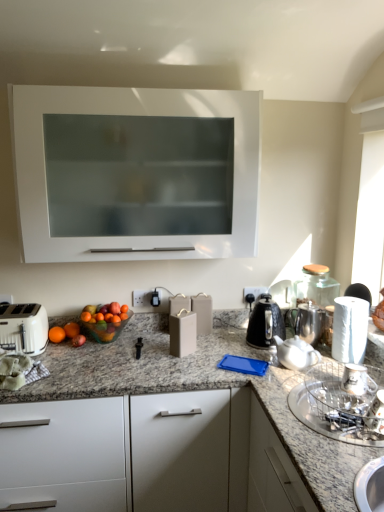
Question: Is white paper towel at right to the right of matte gray wine box at center, the first appliance from the back, from the viewer's perspective?

Choices:
 (A) no
 (B) yes

Answer: (B)

Question: Considering the relative sizes of white paper towel at right and matte gray wine box at center, the first appliance from the back, in the image provided, is white paper towel at right smaller than matte gray wine box at center, the first appliance from the back,?

Choices:
 (A) no
 (B) yes

Answer: (A)

Question: Does white paper towel at right have a larger size compared to matte gray wine box at center, which appears as the third appliance when viewed from the right?

Choices:
 (A) yes
 (B) no

Answer: (A)

Question: From the image's perspective, is white paper towel at right above matte gray wine box at center, the first appliance from the left?

Choices:
 (A) no
 (B) yes

Answer: (B)

Question: Is white paper towel at right surrounding matte gray wine box at center, the first appliance from the back?

Choices:
 (A) yes
 (B) no

Answer: (B)

Question: Is white paper towel at right outside matte gray wine box at center, which appears as the third appliance when viewed from the right?

Choices:
 (A) yes
 (B) no

Answer: (A)

Question: Considering the relative sizes of orange matte at left and white paper towel at right in the image provided, is orange matte at left wider than white paper towel at right?

Choices:
 (A) no
 (B) yes

Answer: (A)

Question: From the image's perspective, is orange matte at left located beneath white paper towel at right?

Choices:
 (A) no
 (B) yes

Answer: (B)

Question: Can you confirm if orange matte at left is thinner than white paper towel at right?

Choices:
 (A) no
 (B) yes

Answer: (B)

Question: Can you confirm if orange matte at left is shorter than white paper towel at right?

Choices:
 (A) yes
 (B) no

Answer: (A)

Question: Can you confirm if orange matte at left is positioned to the right of white paper towel at right?

Choices:
 (A) yes
 (B) no

Answer: (B)

Question: From the image's perspective, does orange matte at left appear higher than white paper towel at right?

Choices:
 (A) no
 (B) yes

Answer: (A)

Question: From the image's perspective, is black metallic kettle at right above satin silver coffee pot at right?

Choices:
 (A) yes
 (B) no

Answer: (A)